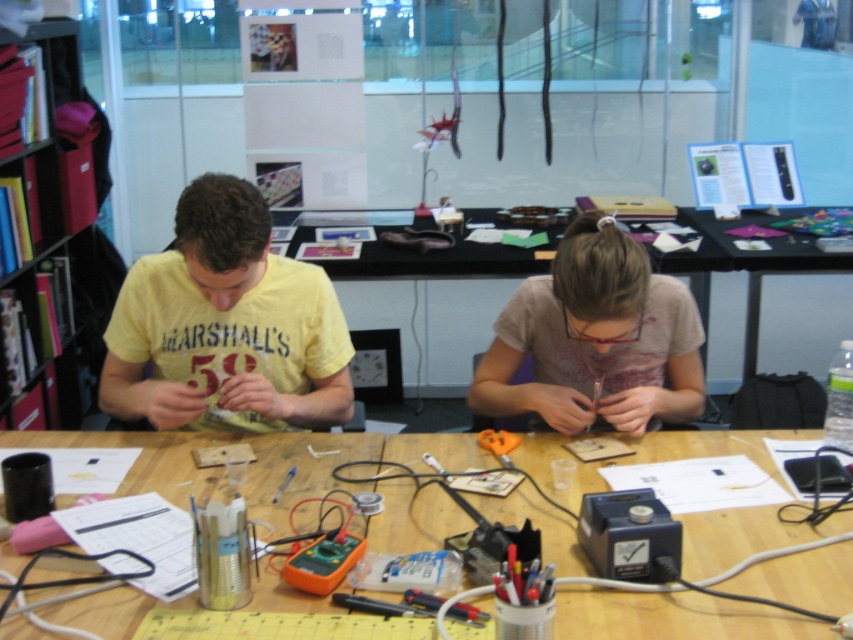
Between pink fabric shirt at center and orange plastic tool at center, which one appears on the left side from the viewer's perspective?

orange plastic tool at center is more to the left.

Is pink fabric shirt at center in front of orange plastic tool at center?

Yes, it is in front of orange plastic tool at center.

Does point (672, 394) come farther from viewer compared to point (480, 436)?

Yes, point (672, 394) is farther from viewer.

Where is `pink fabric shirt at center`? The image size is (853, 640). pink fabric shirt at center is located at coordinates (595, 339).

Does black plastic table at upper right have a lesser height compared to clear plastic ruler at center?

Incorrect, black plastic table at upper right's height does not fall short of clear plastic ruler at center's.

Is black plastic table at upper right thinner than clear plastic ruler at center?

No, black plastic table at upper right is not thinner than clear plastic ruler at center.

Is point (753, 252) positioned after point (289, 476)?

Yes, point (753, 252) is behind point (289, 476).

At what (x,y) coordinates should I click in order to perform the action: click on black plastic table at upper right. Please return your answer as a coordinate pair (x, y). Image resolution: width=853 pixels, height=640 pixels. Looking at the image, I should click on (750, 268).

Is black plastic table at upper right taller than orange plastic tool at center?

Yes.

Between black plastic table at upper right and orange plastic tool at center, which one appears on the left side from the viewer's perspective?

From the viewer's perspective, orange plastic tool at center appears more on the left side.

The image size is (853, 640). What do you see at coordinates (750, 268) in the screenshot?
I see `black plastic table at upper right` at bounding box center [750, 268].

Locate an element on the screen. This screenshot has width=853, height=640. black plastic table at upper right is located at coordinates (750, 268).